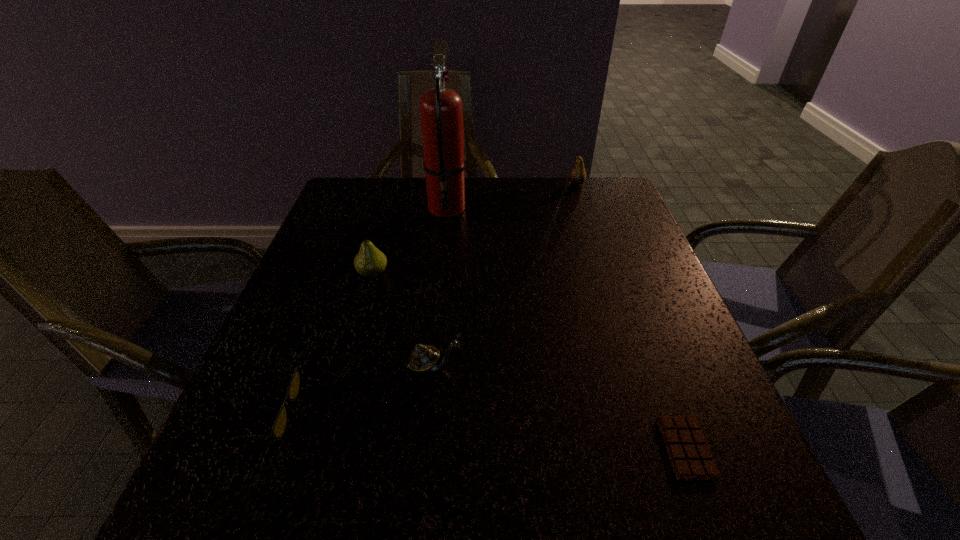
Locate an element on the screen. The height and width of the screenshot is (540, 960). free spot located 0.260m on the hose direction of the tallest object is located at coordinates (438, 293).

Image resolution: width=960 pixels, height=540 pixels. I want to click on vacant area situated on the right of the farthest object, so click(x=605, y=184).

Image resolution: width=960 pixels, height=540 pixels. Identify the location of vacant space located on the back of the nearer pear. (384, 233).

This screenshot has height=540, width=960. In order to click on free space located 0.190m on the face of the third nearest object in this screenshot , I will do `click(564, 367)`.

This screenshot has width=960, height=540. Identify the location of free space located 0.370m on the front-facing side of the sunglasses. (508, 412).

Locate an element on the screen. vacant space located on the back of the shortest object is located at coordinates (623, 279).

Where is `fire extinguisher positioned at the far edge`? Image resolution: width=960 pixels, height=540 pixels. fire extinguisher positioned at the far edge is located at coordinates (441, 110).

Locate an element on the screen. This screenshot has height=540, width=960. pear that is at the far edge is located at coordinates (577, 176).

Locate an element on the screen. object located in the near edge section of the desktop is located at coordinates (689, 453).

Image resolution: width=960 pixels, height=540 pixels. I want to click on pear that is at the left edge, so tap(370, 262).